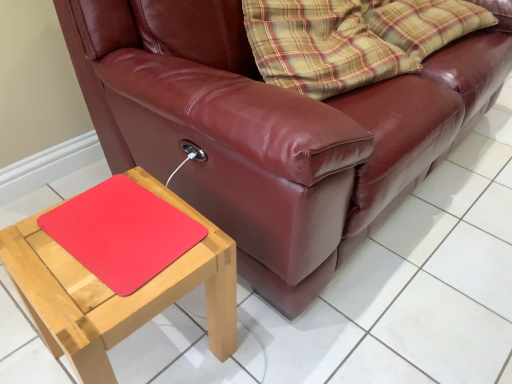
Question: Is leather couch at center taller or shorter than rubberized red mouse pad at lower left?

Choices:
 (A) tall
 (B) short

Answer: (A)

Question: From the image's perspective, is leather couch at center located above or below rubberized red mouse pad at lower left?

Choices:
 (A) above
 (B) below

Answer: (A)

Question: Which object is positioned closest to the leather couch at center?

Choices:
 (A) natural wood table at lower left
 (B) rubberized red mouse pad at lower left

Answer: (A)

Question: Which object is the closest to the leather couch at center?

Choices:
 (A) natural wood table at lower left
 (B) rubberized red mouse pad at lower left

Answer: (A)